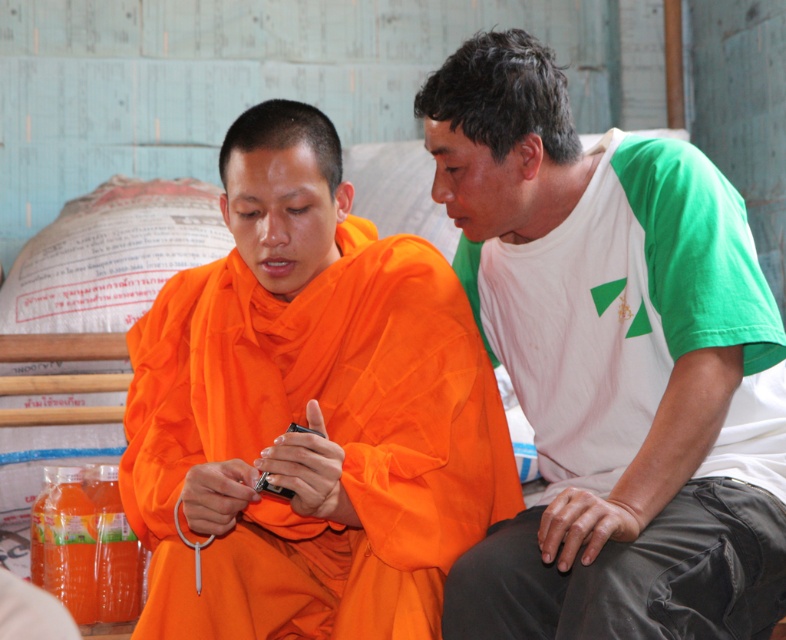
Question: Does white-green t-shirt at right have a lesser width compared to orange cloth at center?

Choices:
 (A) yes
 (B) no

Answer: (A)

Question: Which object is closer to the camera taking this photo?

Choices:
 (A) orange cloth at center
 (B) white-green t-shirt at right

Answer: (B)

Question: Can you confirm if white-green t-shirt at right is thinner than orange cloth at center?

Choices:
 (A) yes
 (B) no

Answer: (A)

Question: Can you confirm if white-green t-shirt at right is wider than orange cloth at center?

Choices:
 (A) yes
 (B) no

Answer: (B)

Question: Which point is closer to the camera?

Choices:
 (A) orange cloth at center
 (B) white-green t-shirt at right

Answer: (B)

Question: Which of the following is the farthest from the observer?

Choices:
 (A) orange cloth at center
 (B) white-green t-shirt at right

Answer: (A)